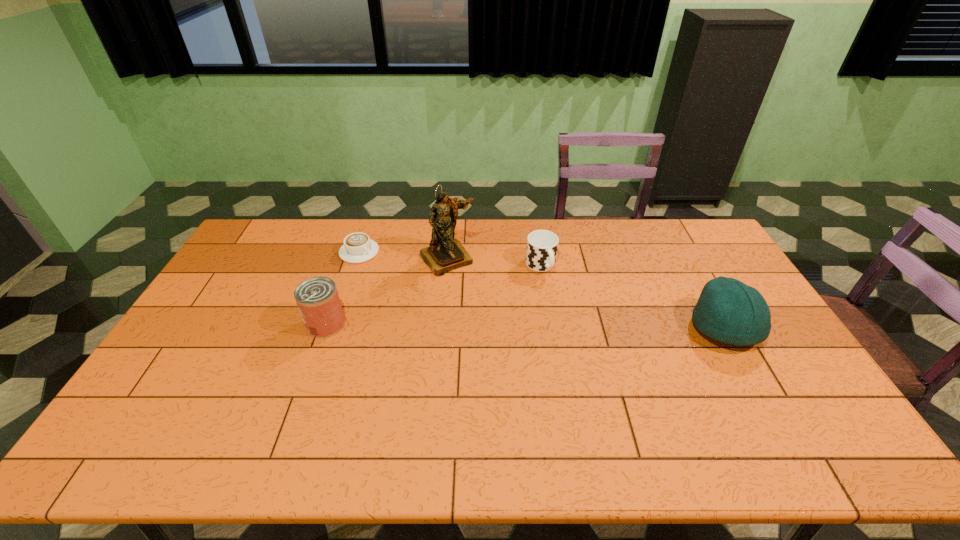
Locate an element on the screen. This screenshot has height=540, width=960. vacant point located 0.230m on the side of the cup with the handle is located at coordinates (579, 326).

Locate an element on the screen. Image resolution: width=960 pixels, height=540 pixels. vacant area situated 0.280m on the side of the cup with the handle is located at coordinates (587, 338).

The width and height of the screenshot is (960, 540). I want to click on vacant space situated on the front-facing side of the tallest object, so click(508, 343).

This screenshot has width=960, height=540. What are the coordinates of `free region located 0.200m on the front-facing side of the tallest object` in the screenshot? It's located at (486, 312).

The image size is (960, 540). I want to click on free space located 0.310m on the front-facing side of the tallest object, so (503, 336).

Where is `blank space located with the handle on the right side of the shortest object`? blank space located with the handle on the right side of the shortest object is located at coordinates (384, 266).

The height and width of the screenshot is (540, 960). In order to click on vacant region located 0.190m with the handle on the right side of the shortest object in this screenshot , I will do `click(411, 281)`.

The height and width of the screenshot is (540, 960). What are the coordinates of `free location located with the handle on the right side of the shortest object` in the screenshot? It's located at (407, 279).

Locate an element on the screen. The image size is (960, 540). cup that is at the far edge is located at coordinates (542, 245).

Locate an element on the screen. The image size is (960, 540). figurine that is at the far edge is located at coordinates (445, 253).